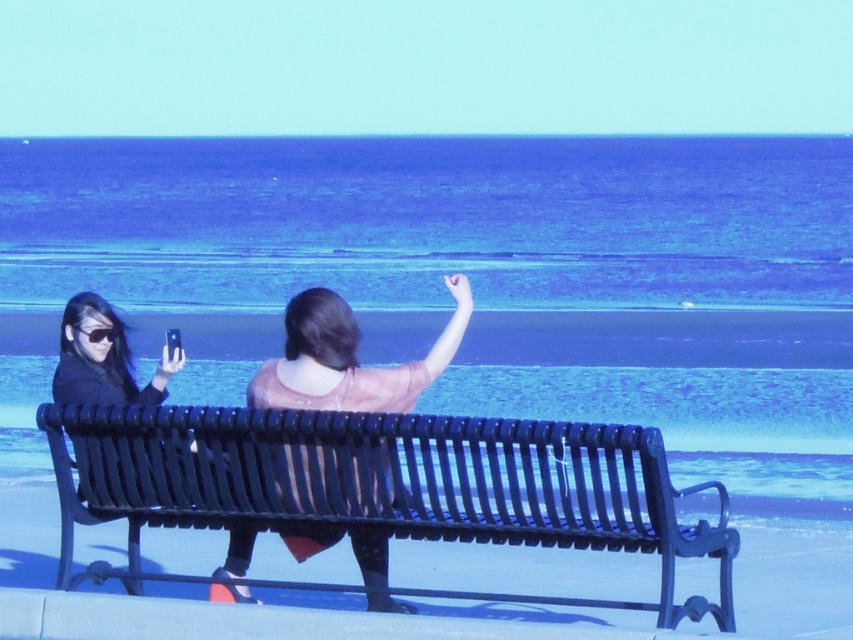
Question: Does black metal bench at lower center have a lesser width compared to pink sheer blouse at center?

Choices:
 (A) yes
 (B) no

Answer: (B)

Question: Among these objects, which one is nearest to the camera?

Choices:
 (A) matte black hair at left
 (B) pink sheer blouse at center
 (C) matte black goggles at left

Answer: (B)

Question: Is black metal bench at lower center bigger than matte black goggles at left?

Choices:
 (A) no
 (B) yes

Answer: (B)

Question: Can you confirm if black metal bench at lower center is positioned to the left of pink sheer blouse at center?

Choices:
 (A) yes
 (B) no

Answer: (B)

Question: Which point is closer to the camera?

Choices:
 (A) matte black goggles at left
 (B) pink sheer blouse at center
 (C) matte black hair at left

Answer: (B)

Question: Which point is farther to the camera?

Choices:
 (A) matte black hair at left
 (B) matte black goggles at left

Answer: (B)